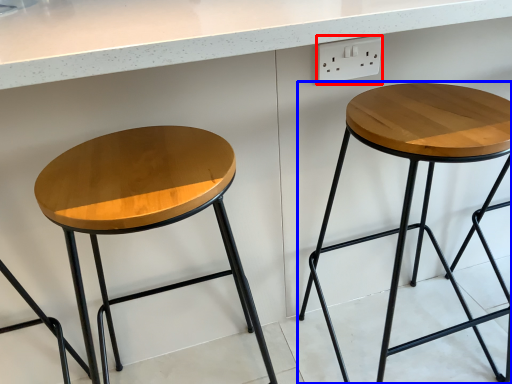
Question: Which object is closer to the camera taking this photo, electric outlet (highlighted by a red box) or stool (highlighted by a blue box)?

Choices:
 (A) electric outlet
 (B) stool

Answer: (B)